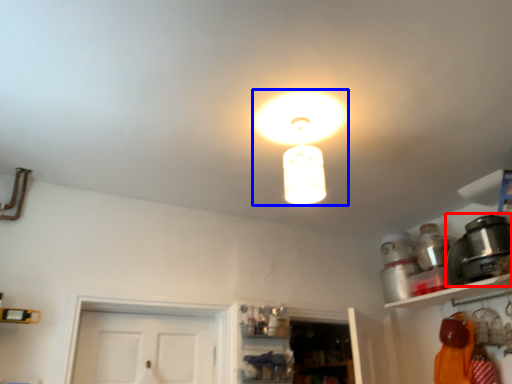
Question: Which of the following is the farthest to the observer, appliance (highlighted by a red box) or lamp (highlighted by a blue box)?

Choices:
 (A) appliance
 (B) lamp

Answer: (A)